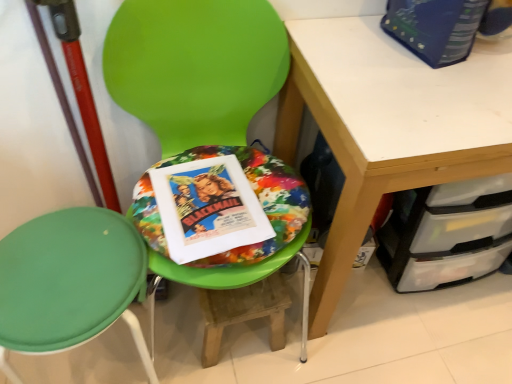
Locate an element on the screen. The height and width of the screenshot is (384, 512). vacant area situated below green fabric chair at center, the first chair viewed from the left (from a real-world perspective) is located at coordinates (98, 365).